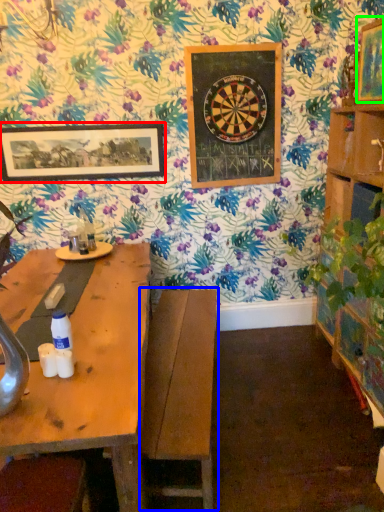
Question: Which object is the farthest from picture frame (highlighted by a red box)? Choose among these: swivel chair (highlighted by a blue box) or picture frame (highlighted by a green box).

Choices:
 (A) swivel chair
 (B) picture frame

Answer: (B)